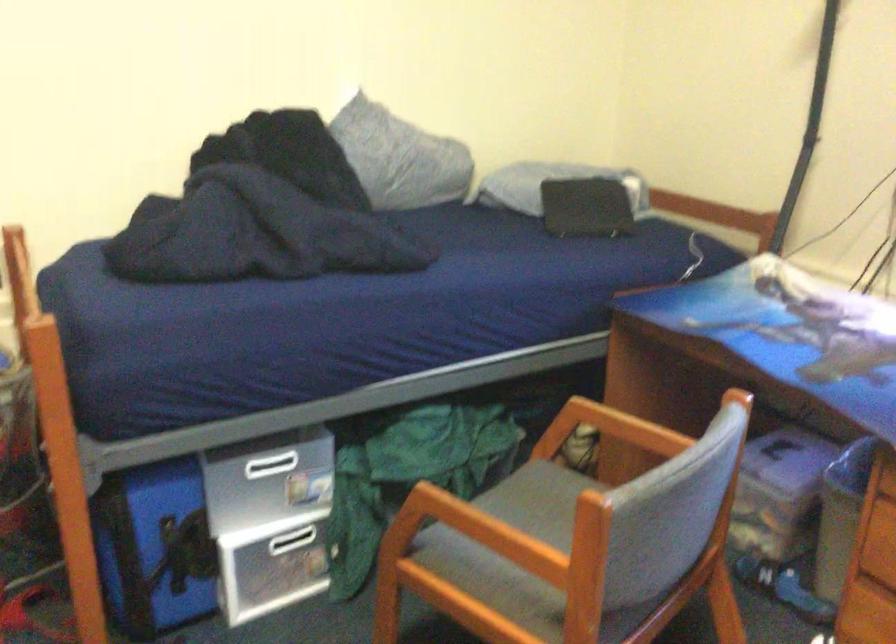
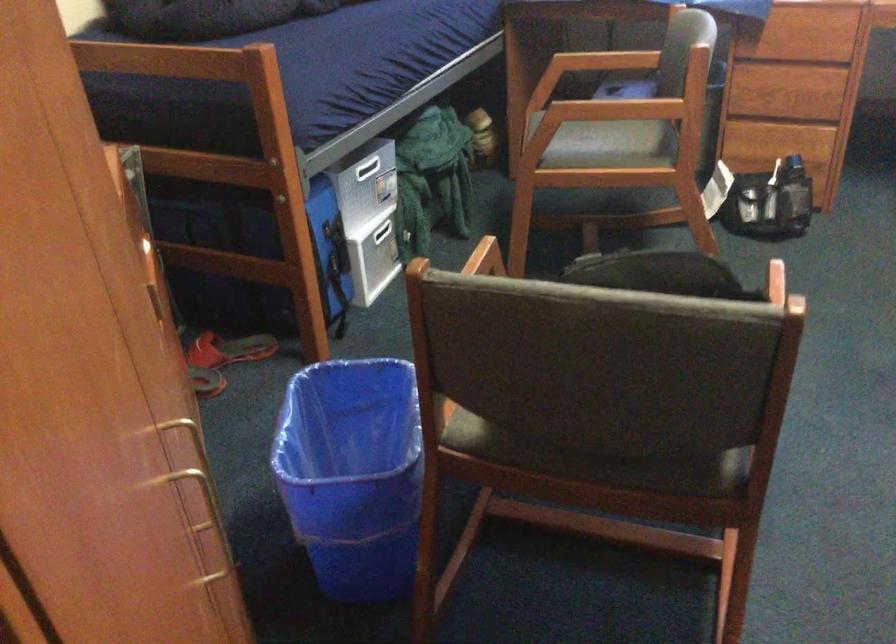
In the second image, find the point that corresponds to the point at 291,464 in the first image.

(366, 167)